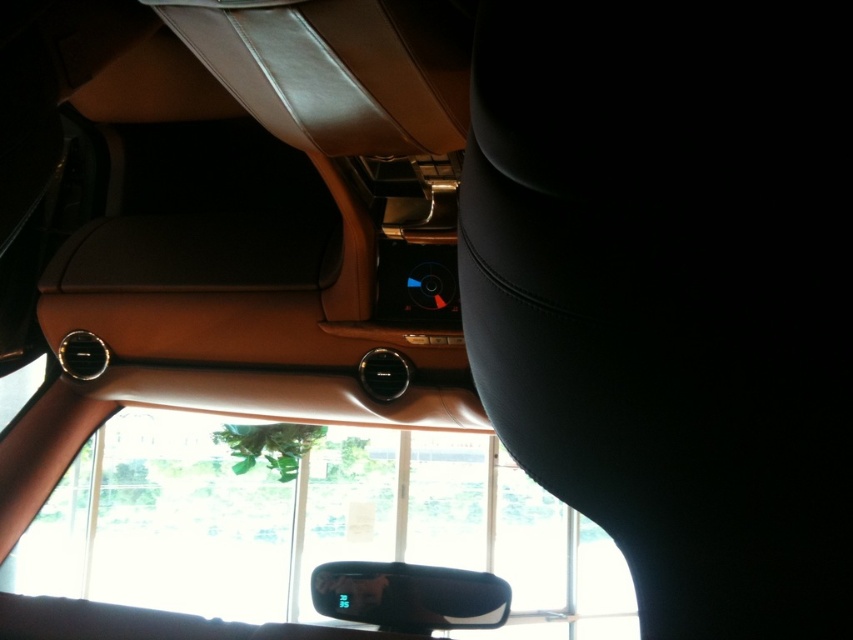
Question: Does black leather seat at center appear on the left side of black glossy rearview mirror at center?

Choices:
 (A) no
 (B) yes

Answer: (A)

Question: Which point is closer to the camera taking this photo?

Choices:
 (A) (827, 49)
 (B) (467, 577)

Answer: (A)

Question: Is black leather seat at center closer to camera compared to black glossy rearview mirror at center?

Choices:
 (A) yes
 (B) no

Answer: (A)

Question: Which object appears closest to the camera in this image?

Choices:
 (A) black glossy rearview mirror at center
 (B) black leather seat at center

Answer: (B)

Question: Which point is farther to the camera?

Choices:
 (A) black glossy rearview mirror at center
 (B) black leather seat at center

Answer: (A)

Question: Is black leather seat at center to the left of black glossy rearview mirror at center from the viewer's perspective?

Choices:
 (A) yes
 (B) no

Answer: (B)